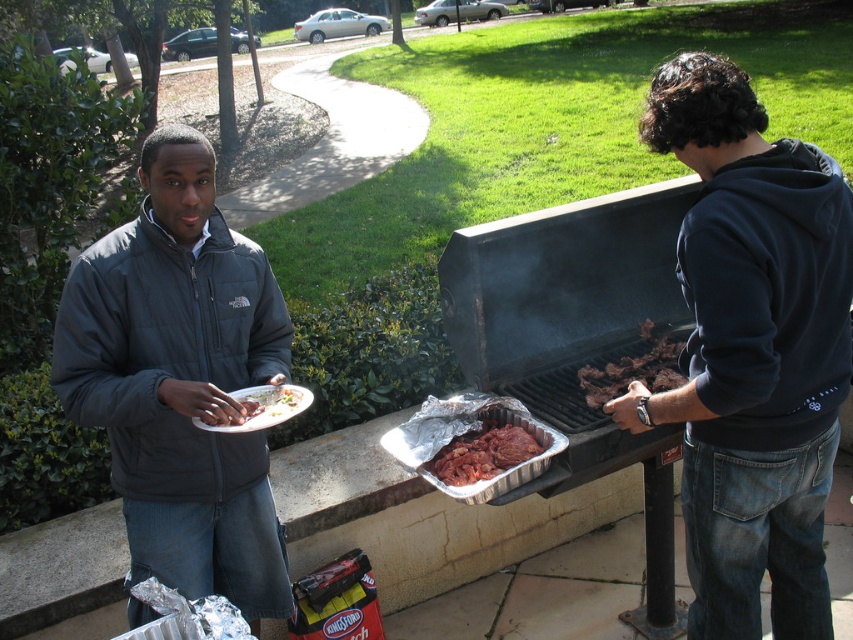
Is the position of dark gray fleece jacket at left less distant than that of raw red meat at center?

That is True.

Does dark gray fleece jacket at left have a smaller size compared to raw red meat at center?

Actually, dark gray fleece jacket at left might be larger than raw red meat at center.

This screenshot has width=853, height=640. What are the coordinates of `dark gray fleece jacket at left` in the screenshot? It's located at (180, 380).

Which is below, dark gray fleece jacket at left or dark blue fleece sweatshirt at right?

dark gray fleece jacket at left is lower down.

Is dark gray fleece jacket at left bigger than dark blue fleece sweatshirt at right?

Indeed, dark gray fleece jacket at left has a larger size compared to dark blue fleece sweatshirt at right.

You are a GUI agent. You are given a task and a screenshot of the screen. Output one action in this format:
    pyautogui.click(x=<x>, y=<y>)
    Task: Click on the dark gray fleece jacket at left
    This screenshot has width=853, height=640.
    Given the screenshot: What is the action you would take?
    pyautogui.click(x=180, y=380)

Which is more to the left, dark blue fleece sweatshirt at right or white matte plate at center?

white matte plate at center is more to the left.

Can you confirm if dark blue fleece sweatshirt at right is taller than white matte plate at center?

Yes, dark blue fleece sweatshirt at right is taller than white matte plate at center.

At what (x,y) coordinates should I click in order to perform the action: click on dark blue fleece sweatshirt at right. Please return your answer as a coordinate pair (x, y). This screenshot has width=853, height=640. Looking at the image, I should click on (769, 298).